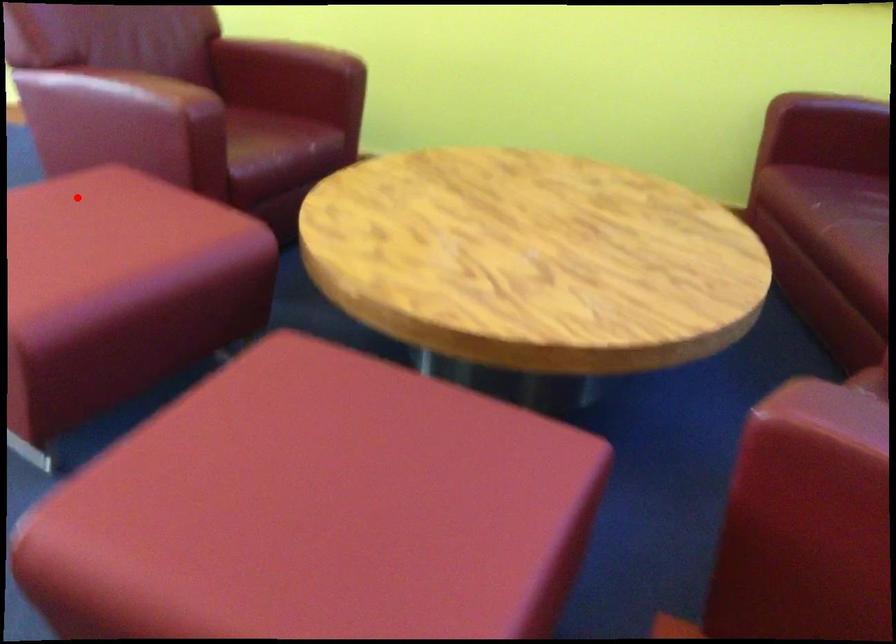
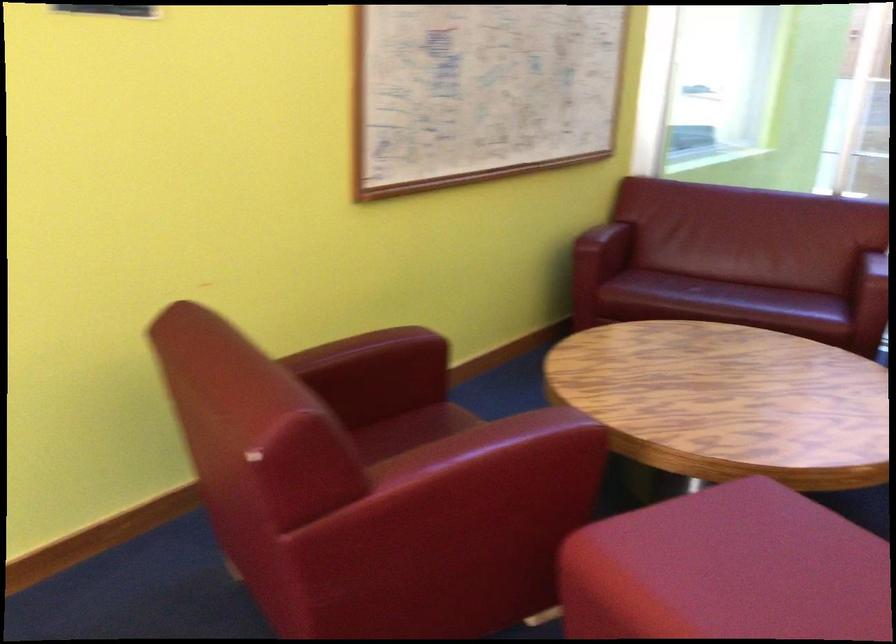
Question: I am providing you with two images of the same scene from different viewpoints. A red point is marked on the first image. Can you still see the location of the red point in image 2?

Choices:
 (A) Yes
 (B) No

Answer: (A)